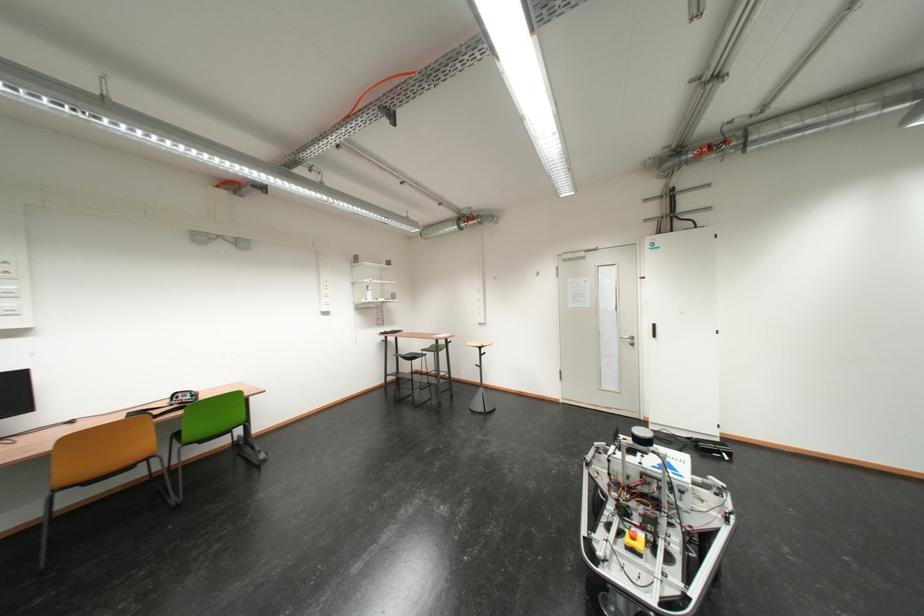
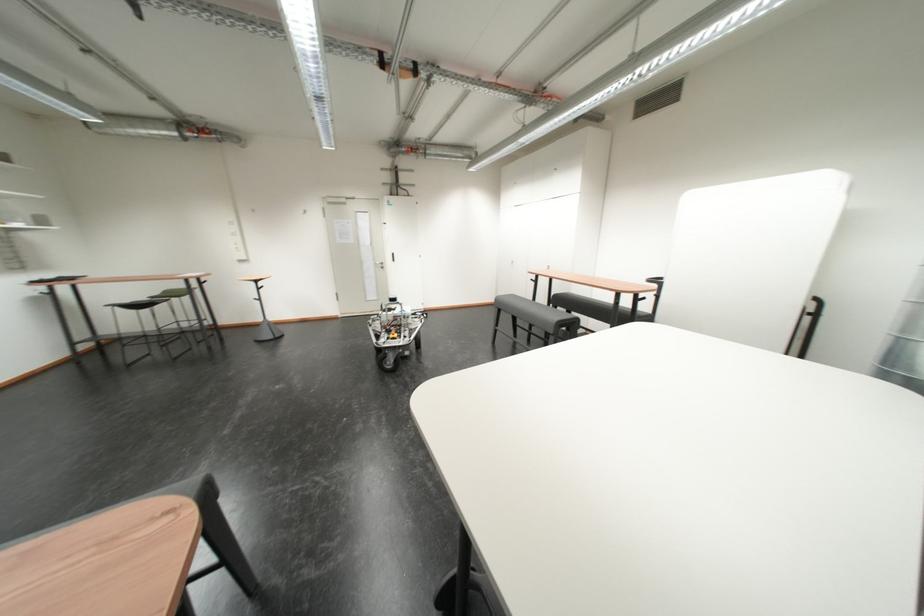
In the second image, find the point that corresponds to (396,533) in the first image.

(246, 416)